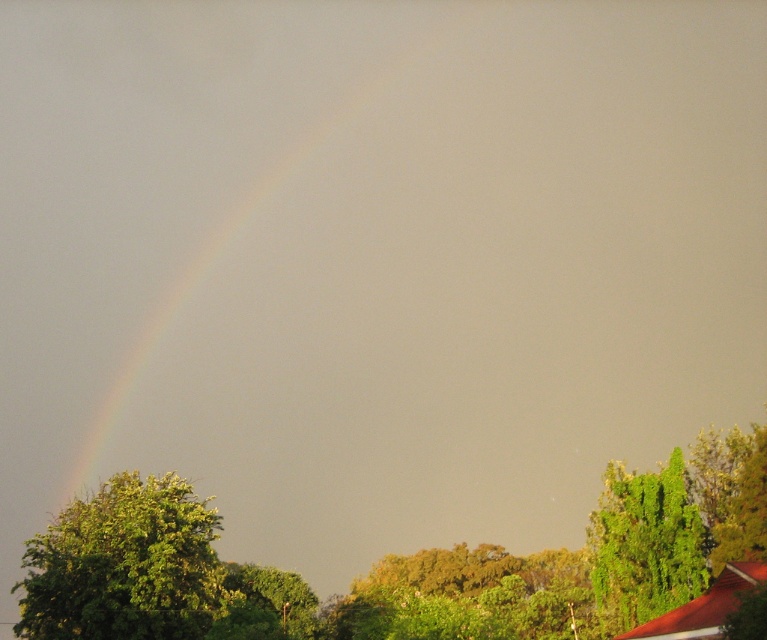
You are standing in the middle of the scene looking towards the rainbow at upper left and the green leafy tree at right. Which object appears taller in the image?

The rainbow at upper left is taller than the green leafy tree at right.

You are standing in the middle of the scene looking upwards. Which object, the rainbow at upper left or the green leafy tree at center, appears higher in the sky?

The rainbow at upper left appears higher in the sky than the green leafy tree at center because it is taller according to the description.

You are standing at the center of the image and want to walk towards the rainbow at upper left and the green leafy tree at right. Which object will you reach first?

The green leafy tree at right will be reached first because it is closer to you than the rainbow at upper left, which is farther away.